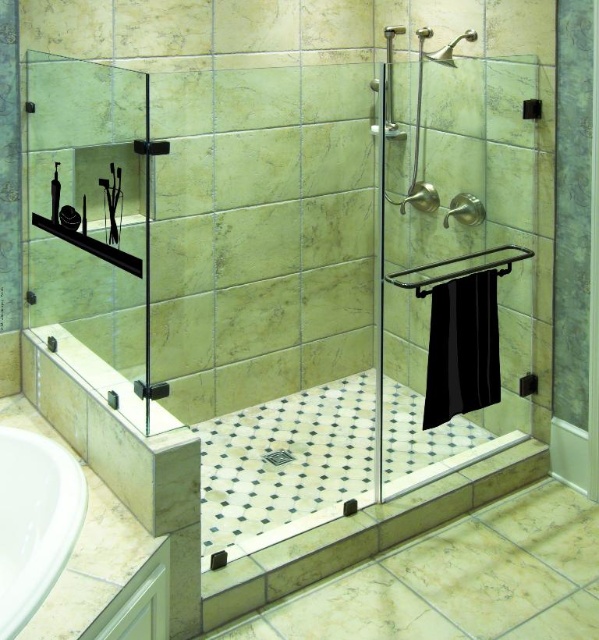
From the picture: You are a plumber who needs to install a new faucet on the white ceramic bathtub at lower left and the white glossy screen door at lower left. Which object requires a wider faucet installation area?

The white ceramic bathtub at lower left requires a wider faucet installation area because its width surpasses that of the white glossy screen door at lower left.

You are a bathroom designer planning to install a new shower curtain rod. You see the white ceramic bathtub at lower left and the white glossy screen door at lower left. Which object is taller and should be considered for curtain rod placement?

The white ceramic bathtub at lower left is taller than the white glossy screen door at lower left, so it should be considered for curtain rod placement.